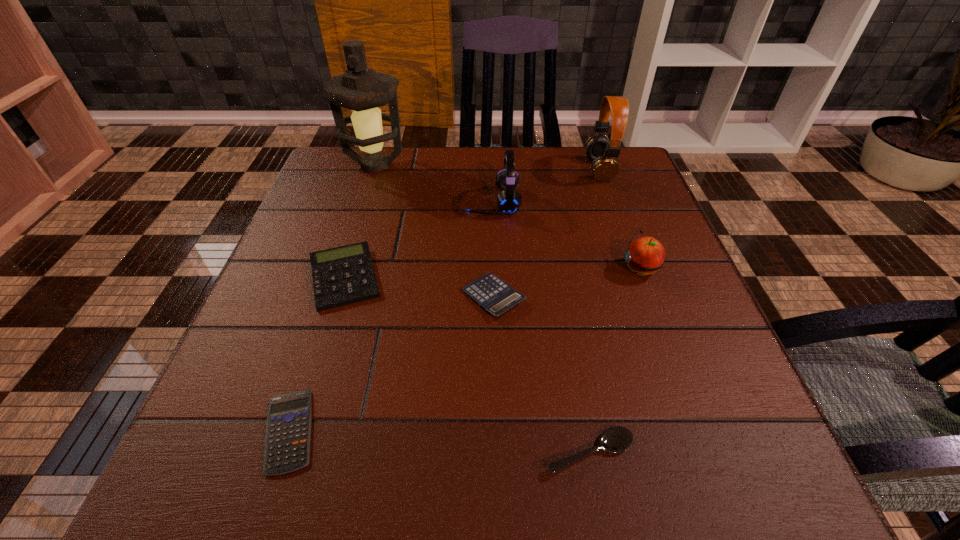
The height and width of the screenshot is (540, 960). I want to click on vacant area at the far edge, so click(466, 147).

Locate an element on the screen. The width and height of the screenshot is (960, 540). vacant space at the near edge of the desktop is located at coordinates (366, 475).

Where is `vacant space at the left edge`? The image size is (960, 540). vacant space at the left edge is located at coordinates (324, 373).

Where is `vacant space at the right edge of the desktop`? The image size is (960, 540). vacant space at the right edge of the desktop is located at coordinates tap(739, 425).

What are the coordinates of `free space at the far left corner of the desktop` in the screenshot? It's located at (352, 147).

In the image, there is a desktop. Where is `vacant space at the far right corner`? The height and width of the screenshot is (540, 960). vacant space at the far right corner is located at coordinates [x=616, y=179].

You are a GUI agent. You are given a task and a screenshot of the screen. Output one action in this format:
    pyautogui.click(x=<x>, y=<y>)
    Task: Click on the vacant point located between the taller headset and the rightmost calculator
    The width and height of the screenshot is (960, 540).
    Given the screenshot: What is the action you would take?
    pyautogui.click(x=546, y=233)

This screenshot has height=540, width=960. I want to click on free space between the shorter headset and the second tallest calculator, so click(492, 249).

The image size is (960, 540). In order to click on empty location between the rightmost calculator and the oil lamp in this screenshot , I will do `click(435, 231)`.

Locate an element on the screen. free spot between the second shortest calculator and the fourth tallest object is located at coordinates (567, 282).